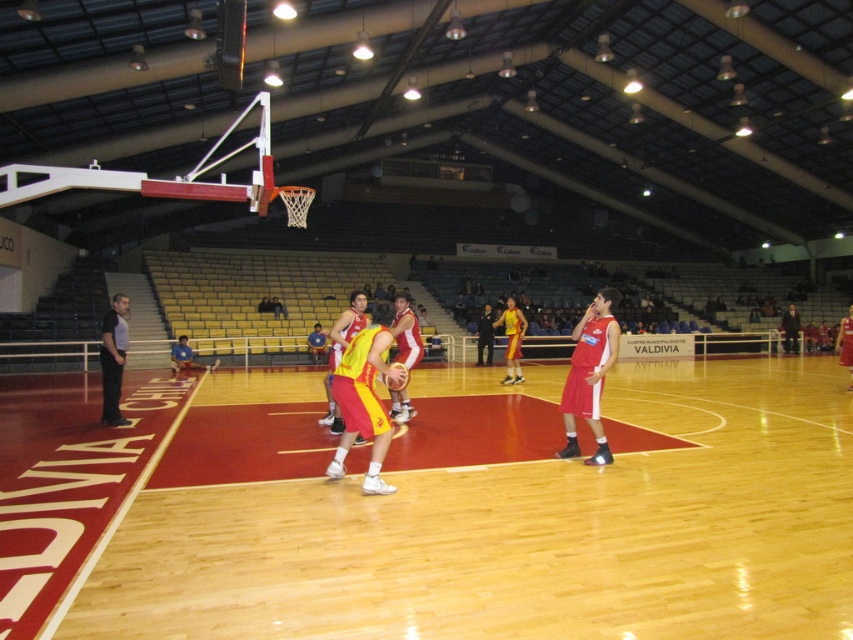
You are a spectator sitting at the back of the gymnasium watching the basketball game. You notice the matte red shorts at center and the yellow matte basketball at center. From your perspective, which object is positioned to the right of the other?

The matte red shorts at center is to the right of the yellow matte basketball at center.

You are a referee observing the basketball game. You notice two players at the center of the court. Which player is taller between the yellow matte basketball player at center and the red jersey at center?

The yellow matte basketball player at center is taller than the red jersey at center.